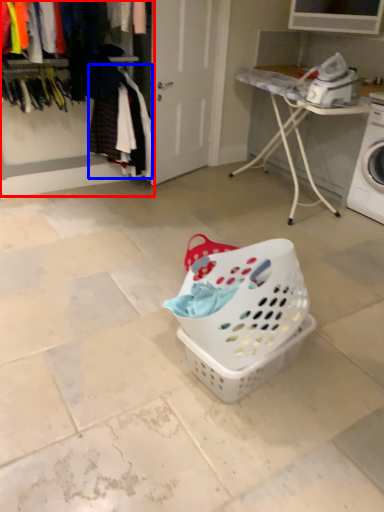
Question: Among these objects, which one is farthest to the camera, closet (highlighted by a red box) or clothing (highlighted by a blue box)?

Choices:
 (A) closet
 (B) clothing

Answer: (B)